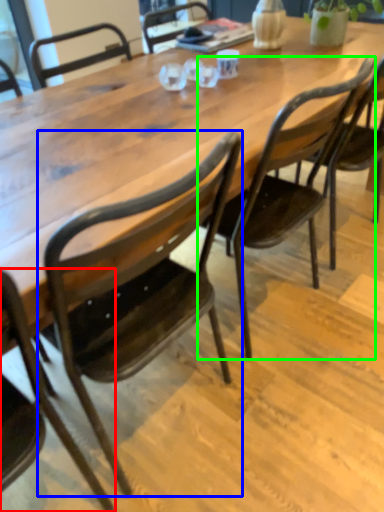
Question: Which is nearer to the chair (highlighted by a red box)? chair (highlighted by a blue box) or chair (highlighted by a green box).

Choices:
 (A) chair
 (B) chair

Answer: (A)